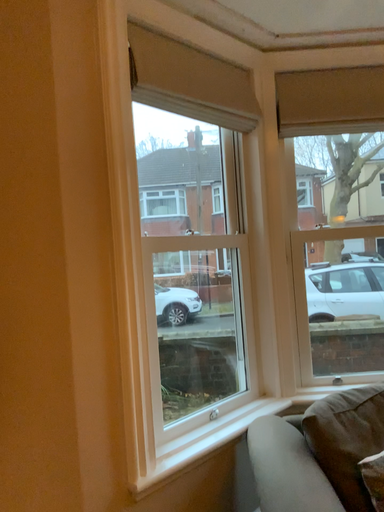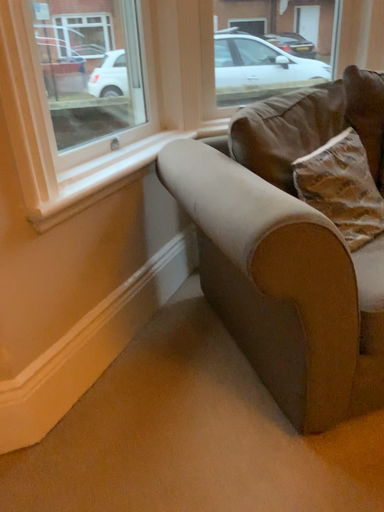
Question: How did the camera likely rotate when shooting the video?

Choices:
 (A) rotated left
 (B) rotated right

Answer: (B)